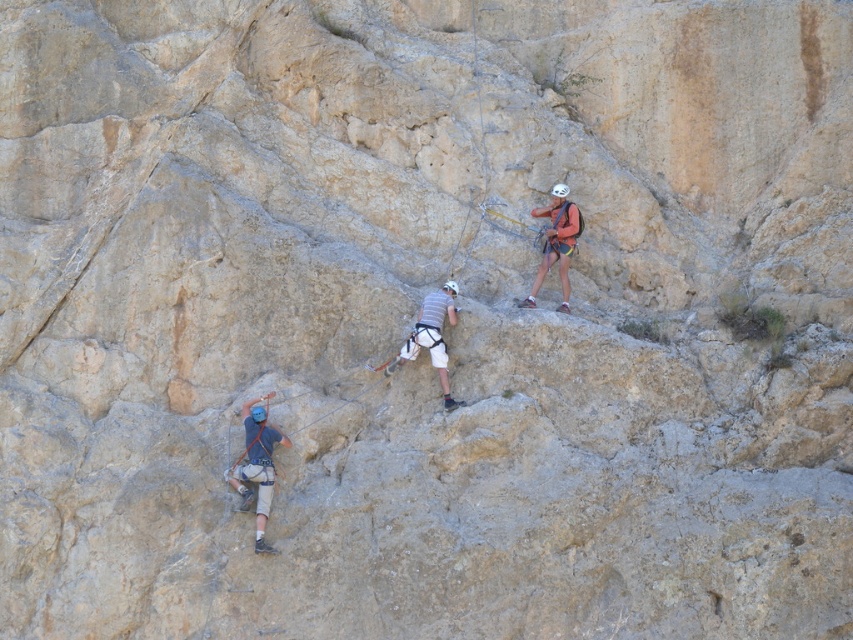
You are a safety inspector assessing the climbing setup. You observe the blue matte climbing harness at lower left and the white matte climbing harness at center. Which harness is positioned lower on the cliff?

The blue matte climbing harness at lower left is positioned lower on the cliff than the white matte climbing harness at center.

You are a rock climber trying to reach the top of the cliff. You see the blue matte climbing harness at lower left and the white matte climbing harness at center. Which harness is positioned to the left side of the other?

The blue matte climbing harness at lower left is positioned to the left of the white matte climbing harness at center.